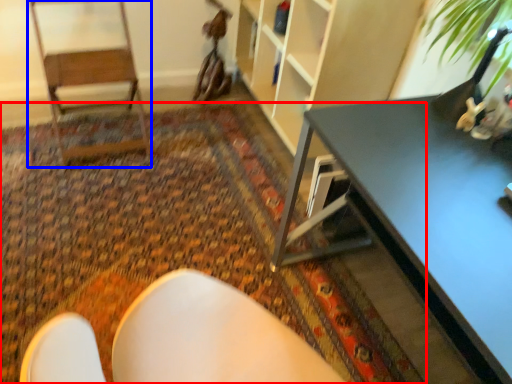
Question: Which object appears closest to the camera in this image, mat (highlighted by a red box) or armchair (highlighted by a blue box)?

Choices:
 (A) mat
 (B) armchair

Answer: (A)